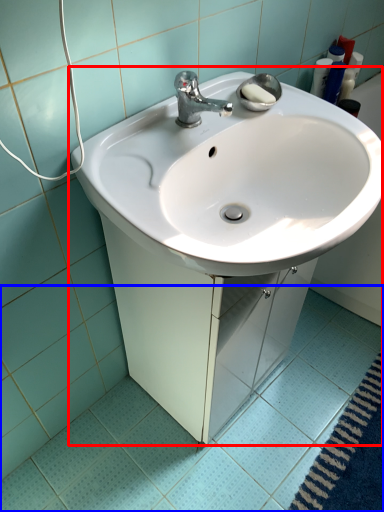
Question: Which object appears closest to the camera in this image, sink (highlighted by a red box) or ceramic tile (highlighted by a blue box)?

Choices:
 (A) sink
 (B) ceramic tile

Answer: (A)